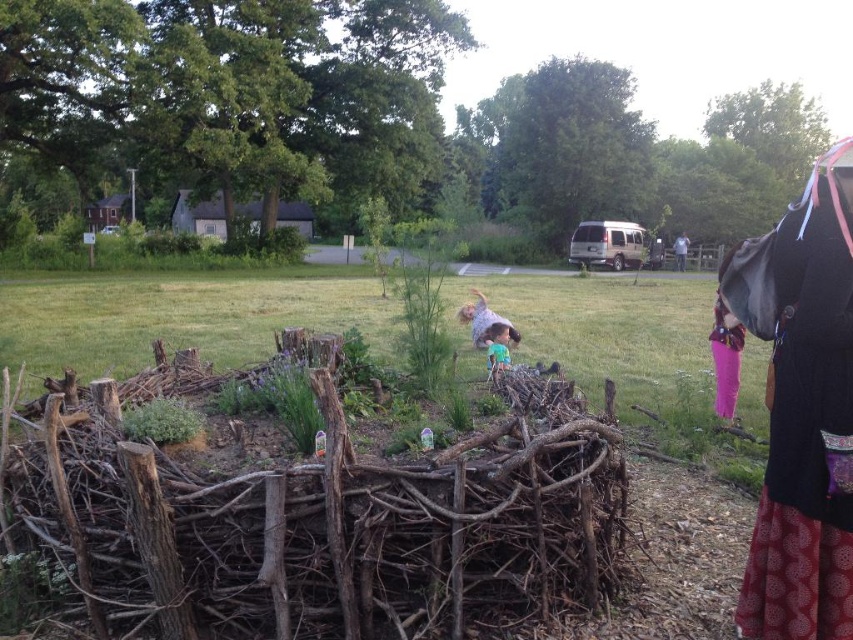
Question: Which object is farther from the camera taking this photo?

Choices:
 (A) wooden hut at upper left
 (B) black fabric bag at right
 (C) light blue shirt at center
 (D) pink fabric at lower right

Answer: (D)

Question: Does green matte shirt at center appear on the right side of pink fabric at lower right?

Choices:
 (A) yes
 (B) no

Answer: (B)

Question: Which is nearer to the wooden hut at upper left?

Choices:
 (A) green matte shirt at center
 (B) green leafy plant at center
 (C) black fabric bag at right

Answer: (C)

Question: Does green matte shirt at center come in front of pink fabric at lower right?

Choices:
 (A) yes
 (B) no

Answer: (A)

Question: Which of the following is the closest to the observer?

Choices:
 (A) (502, 344)
 (B) (471, 337)
 (C) (253, 212)
 (D) (679, 248)

Answer: (A)

Question: Can you confirm if wooden hut at upper left is bigger than light blue shirt at center?

Choices:
 (A) yes
 (B) no

Answer: (A)